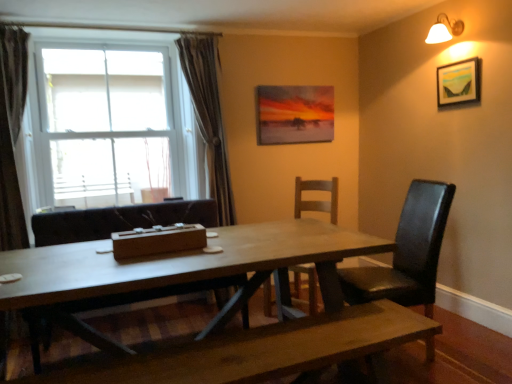
Question: From the image's perspective, would you say wooden chair at center, which is the 2th chair in right-to-left order, is shown under white glass window at upper left?

Choices:
 (A) no
 (B) yes

Answer: (B)

Question: Does wooden chair at center, which is the 2th chair in right-to-left order, come in front of white glass window at upper left?

Choices:
 (A) no
 (B) yes

Answer: (B)

Question: Are wooden chair at center, the second chair positioned from the left, and white glass window at upper left far apart?

Choices:
 (A) no
 (B) yes

Answer: (B)

Question: Is wooden chair at center, the second chair positioned from the left, to the left of white glass window at upper left from the viewer's perspective?

Choices:
 (A) no
 (B) yes

Answer: (A)

Question: From the image's perspective, is wooden chair at center, which is the 2th chair in right-to-left order, on top of white glass window at upper left?

Choices:
 (A) no
 (B) yes

Answer: (A)

Question: From a real-world perspective, is wooden chair at center, which is the 2th chair in right-to-left order, below white glass window at upper left?

Choices:
 (A) yes
 (B) no

Answer: (A)

Question: Considering the relative positions of white ceramic wall lamp at upper right and white glass window at upper left in the image provided, is white ceramic wall lamp at upper right to the left of white glass window at upper left from the viewer's perspective?

Choices:
 (A) no
 (B) yes

Answer: (A)

Question: From the image's perspective, is white ceramic wall lamp at upper right above white glass window at upper left?

Choices:
 (A) no
 (B) yes

Answer: (B)

Question: Is white ceramic wall lamp at upper right directly adjacent to white glass window at upper left?

Choices:
 (A) no
 (B) yes

Answer: (A)

Question: Can you confirm if white ceramic wall lamp at upper right is thinner than white glass window at upper left?

Choices:
 (A) no
 (B) yes

Answer: (B)

Question: Can you confirm if white ceramic wall lamp at upper right is smaller than white glass window at upper left?

Choices:
 (A) no
 (B) yes

Answer: (B)

Question: Is white ceramic wall lamp at upper right positioned in front of white glass window at upper left?

Choices:
 (A) yes
 (B) no

Answer: (A)

Question: Considering the relative sizes of white glass window at upper left and matte canvas painting at upper center, placed as the second picture frame when sorted from front to back, in the image provided, is white glass window at upper left thinner than matte canvas painting at upper center, placed as the second picture frame when sorted from front to back,?

Choices:
 (A) yes
 (B) no

Answer: (B)